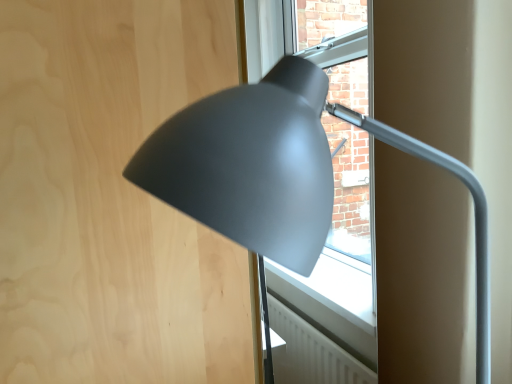
Describe the element at coordinates (110, 199) in the screenshot. I see `matte wood plywood at upper left` at that location.

Where is `matte wood plywood at upper left`? This screenshot has height=384, width=512. matte wood plywood at upper left is located at coordinates (110, 199).

Image resolution: width=512 pixels, height=384 pixels. I want to click on matte gray lamp at center, so click(x=278, y=171).

Describe the element at coordinates (278, 171) in the screenshot. I see `matte gray lamp at center` at that location.

The width and height of the screenshot is (512, 384). In order to click on matte wood plywood at upper left in this screenshot , I will do `click(110, 199)`.

Which object is positioned more to the right, matte wood plywood at upper left or matte gray lamp at center?

Positioned to the right is matte gray lamp at center.

Is matte wood plywood at upper left in front of or behind matte gray lamp at center in the image?

Visually, matte wood plywood at upper left is located behind matte gray lamp at center.

Is point (120, 295) closer to camera compared to point (150, 151)?

No, (120, 295) is behind (150, 151).

From the image's perspective, which is below, matte wood plywood at upper left or matte gray lamp at center?

From the image's view, matte wood plywood at upper left is below.

From a real-world perspective, is matte wood plywood at upper left positioned above or below matte gray lamp at center?

matte wood plywood at upper left is situated lower than matte gray lamp at center in the real world.

Considering the relative sizes of matte wood plywood at upper left and matte gray lamp at center in the image provided, is matte wood plywood at upper left thinner than matte gray lamp at center?

In fact, matte wood plywood at upper left might be wider than matte gray lamp at center.

Who is taller, matte wood plywood at upper left or matte gray lamp at center?

With more height is matte wood plywood at upper left.

Does matte wood plywood at upper left have a smaller size compared to matte gray lamp at center?

Actually, matte wood plywood at upper left might be larger than matte gray lamp at center.

Is matte wood plywood at upper left not inside matte gray lamp at center?

Yes, matte wood plywood at upper left is outside of matte gray lamp at center.

Would you consider matte wood plywood at upper left to be distant from matte gray lamp at center?

matte wood plywood at upper left is actually quite close to matte gray lamp at center.

Is matte wood plywood at upper left facing away from matte gray lamp at center?

Correct, matte wood plywood at upper left is looking away from matte gray lamp at center.

How many degrees apart are the facing directions of matte wood plywood at upper left and matte gray lamp at center?

90.6 degrees.

Measure the distance from matte wood plywood at upper left to matte gray lamp at center.

matte wood plywood at upper left and matte gray lamp at center are 11.77 inches apart from each other.

The width and height of the screenshot is (512, 384). In order to click on plywood that is under the matte gray lamp at center (from a real-world perspective) in this screenshot , I will do pyautogui.click(x=110, y=199).

Which object is positioned more to the left, matte gray lamp at center or matte wood plywood at upper left?

Positioned to the left is matte wood plywood at upper left.

Is matte gray lamp at center in front of or behind matte wood plywood at upper left in the image?

Visually, matte gray lamp at center is located in front of matte wood plywood at upper left.

Considering the positions of points (303, 109) and (46, 204), is point (303, 109) farther from camera compared to point (46, 204)?

No, (303, 109) is closer to viewer.

Based on the photo, from the image's perspective, is matte gray lamp at center located above or below matte wood plywood at upper left?

Clearly, from the image's perspective, matte gray lamp at center is above matte wood plywood at upper left.

Consider the image. From a real-world perspective, is matte gray lamp at center physically below matte wood plywood at upper left?

No, from a real-world perspective, matte gray lamp at center is not beneath matte wood plywood at upper left.

Which of these two, matte gray lamp at center or matte wood plywood at upper left, is wider?

With larger width is matte wood plywood at upper left.

Who is taller, matte gray lamp at center or matte wood plywood at upper left?

matte wood plywood at upper left is taller.

Which of these two, matte gray lamp at center or matte wood plywood at upper left, is bigger?

matte wood plywood at upper left is bigger.

Would you say matte gray lamp at center is outside matte wood plywood at upper left?

Absolutely, matte gray lamp at center is external to matte wood plywood at upper left.

Is matte gray lamp at center far away from matte wood plywood at upper left?

No, matte gray lamp at center is not far from matte wood plywood at upper left.

Is matte gray lamp at center oriented towards matte wood plywood at upper left?

No, matte gray lamp at center does not turn towards matte wood plywood at upper left.

The height and width of the screenshot is (384, 512). Find the location of `plywood on the left of the matte gray lamp at center`. plywood on the left of the matte gray lamp at center is located at coordinates (110, 199).

At what (x,y) coordinates should I click in order to perform the action: click on plywood that appears below the matte gray lamp at center (from the image's perspective). Please return your answer as a coordinate pair (x, y). The width and height of the screenshot is (512, 384). Looking at the image, I should click on coord(110,199).

Where is `lamp in front of the matte wood plywood at upper left`? Image resolution: width=512 pixels, height=384 pixels. lamp in front of the matte wood plywood at upper left is located at coordinates (278, 171).